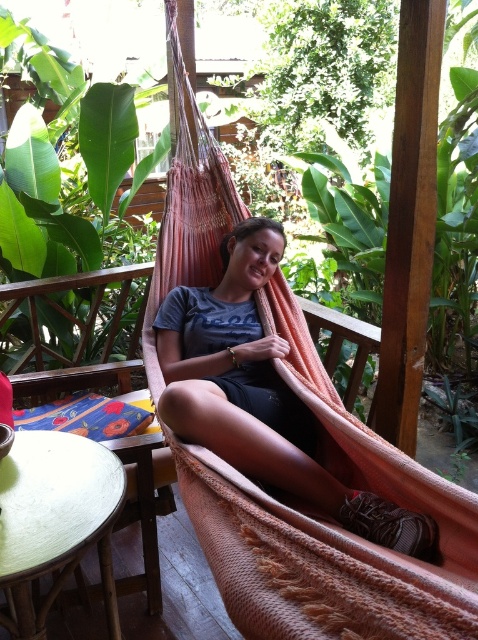
Looking at this image, you are planning to set up a small seating area in your backyard. You have a space that can accommodate either the matte pink hammock at center or the wooden chair at center. Based on the image, which one would you choose if you want to maximize seating capacity?

The wooden chair at center is narrower than the matte pink hammock at center, so choosing the wooden chair at center would allow more seating in the same space.

You are planning to set up a small reading area in the garden. You have a wooden chair at center and a matte pink hammock at center. Which object should you place to the left to ensure there is space for a side table between them?

The wooden chair at center should be placed to the left because the matte pink hammock at center is positioned on the right side of it, allowing space for a side table between them.

You are planning to place a new pink woven hammock at center in your backyard. You have a wooden chair at center currently there. Which object is wider?

The pink woven hammock at center is wider than the wooden chair at center because the pink woven hammock at center has a greater width according to the description.